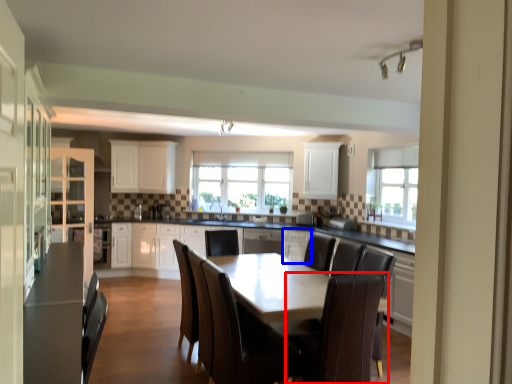
Question: Among these objects, which one is farthest to the camera, chair (highlighted by a red box) or cabinetry (highlighted by a blue box)?

Choices:
 (A) chair
 (B) cabinetry

Answer: (B)